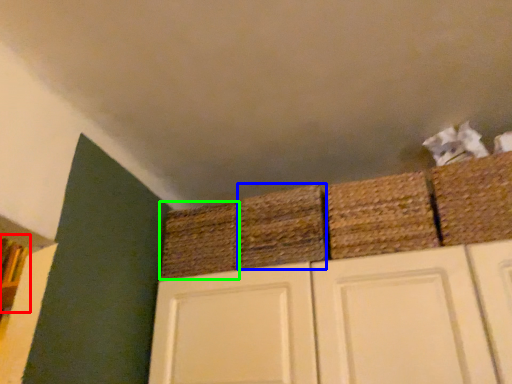
Question: Which is farther away from shelf (highlighted by a red box)? basket (highlighted by a blue box) or basket (highlighted by a green box)?

Choices:
 (A) basket
 (B) basket

Answer: (A)